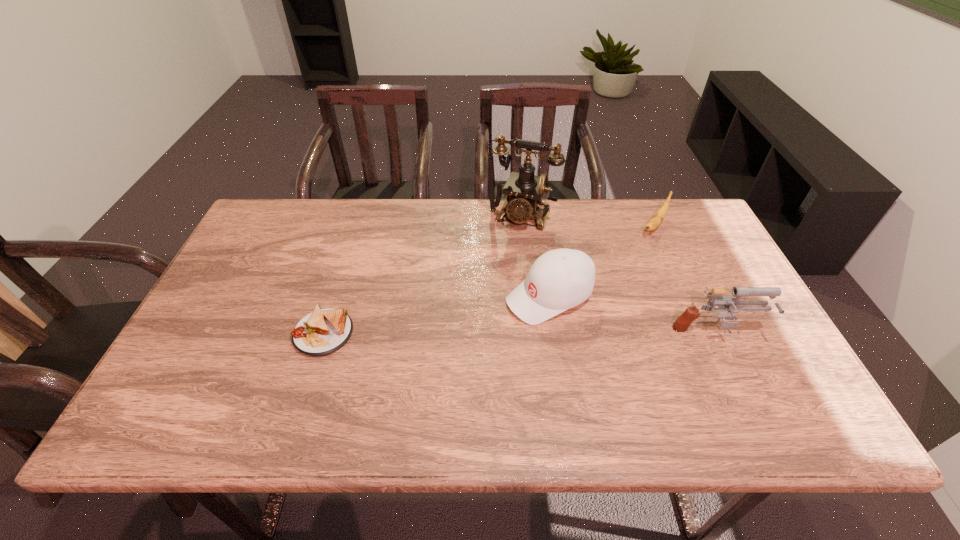
Image resolution: width=960 pixels, height=540 pixels. Find the location of `sandwich`. sandwich is located at coordinates (322, 332).

I want to click on the shortest object, so click(322, 332).

Find the location of a particular element. The image size is (960, 540). gun is located at coordinates (725, 303).

Find the location of a particular element. The image size is (960, 540). baseball cap is located at coordinates pyautogui.click(x=560, y=279).

I want to click on telephone, so click(524, 190).

Image resolution: width=960 pixels, height=540 pixels. I want to click on the fourth tallest object, so click(x=656, y=220).

Find the location of a particular element. The height and width of the screenshot is (540, 960). free location located on the right of the leftmost object is located at coordinates (463, 333).

The height and width of the screenshot is (540, 960). In order to click on vacant space situated 0.270m on the front-facing side of the third shortest object in this screenshot , I will do `click(419, 356)`.

The height and width of the screenshot is (540, 960). I want to click on free location located 0.310m on the front-facing side of the third shortest object, so (x=402, y=363).

Find the location of a particular element. free point located 0.070m on the front-facing side of the third shortest object is located at coordinates (490, 322).